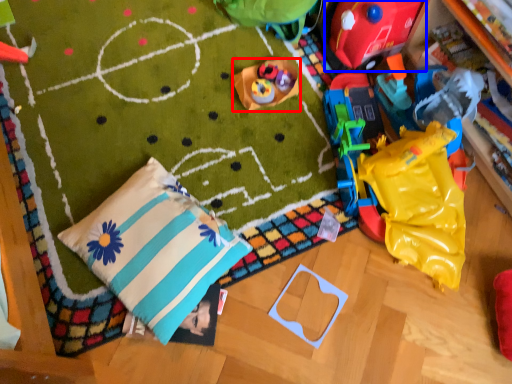
Question: Which object appears closest to the camera in this image, toy (highlighted by a red box) or toy (highlighted by a blue box)?

Choices:
 (A) toy
 (B) toy

Answer: (B)